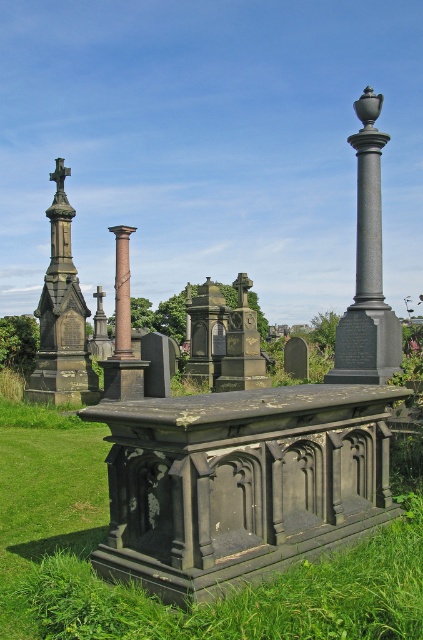
Question: Which object is farther from the camera taking this photo?

Choices:
 (A) smooth gray column at center
 (B) brown marble column at center

Answer: (B)

Question: Is smooth gray column at center to the left of brown marble column at center from the viewer's perspective?

Choices:
 (A) no
 (B) yes

Answer: (A)

Question: Is smooth gray column at center thinner than dark gray stone cross at left?

Choices:
 (A) yes
 (B) no

Answer: (B)

Question: Is dark gray stone cross at left further to camera compared to brown marble column at center?

Choices:
 (A) yes
 (B) no

Answer: (A)

Question: Among these objects, which one is nearest to the camera?

Choices:
 (A) brown marble column at center
 (B) dark gray stone cross at left
 (C) smooth gray column at center

Answer: (C)

Question: Which of these objects is positioned farthest from the brown marble column at center?

Choices:
 (A) smooth gray column at center
 (B) dark gray stone cross at left

Answer: (A)